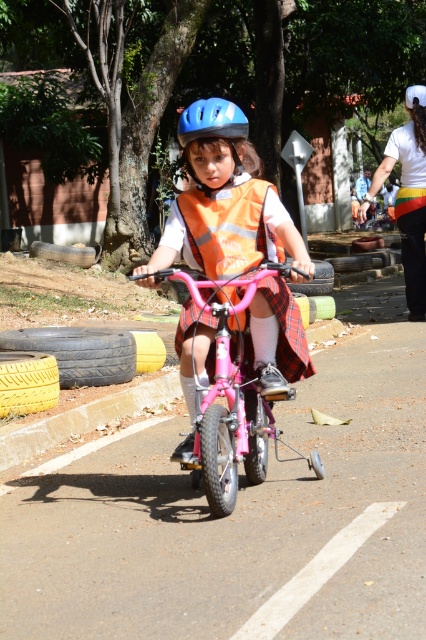
You are a pedestrian walking on the path and see the pink matte bicycle at center and the orange reflective safety vest at center. Which object is closer to you?

The pink matte bicycle at center is closer to you because it is in front of the orange reflective safety vest at center.

You are a pedestrian standing on the path and see the child wearing both the matte orange vest at center and the orange reflective safety vest at center. Which vest is closer to you?

The matte orange vest at center is closer to the viewer than the orange reflective safety vest at center.

You are standing at the point labeled as point (250, 333) and want to throw a ball to someone who is 5 meters away. Can you reach the person with your throw?

The distance between you and the viewer is 5.26 meters, so you cannot reach the person with a 5 meter throw.